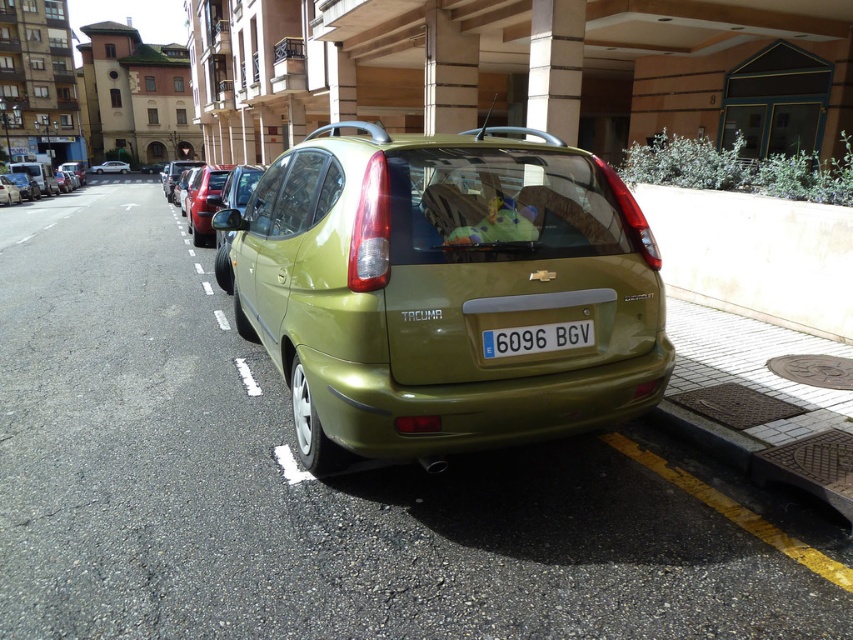
Question: Among these points, which one is nearest to the camera?

Choices:
 (A) (91, 168)
 (B) (57, 166)
 (C) (566, 429)
 (D) (491, 344)

Answer: (D)

Question: Considering the relative positions of olive metallic sedan at center and matte green hatchback at center in the image provided, where is olive metallic sedan at center located with respect to matte green hatchback at center?

Choices:
 (A) right
 (B) left

Answer: (A)

Question: Which object is the farthest from the matte green hatchback at center?

Choices:
 (A) metallic silver sedan at center
 (B) white plastic license plate at center

Answer: (A)

Question: Is white plastic license plate at center bigger than metallic silver car at center?

Choices:
 (A) yes
 (B) no

Answer: (B)

Question: Which is farther from the metallic silver sedan at center?

Choices:
 (A) metallic silver car at center
 (B) white plastic license plate at center
 (C) matte green hatchback at center
 (D) olive metallic sedan at center

Answer: (B)

Question: Considering the relative positions of olive metallic sedan at center and matte green hatchback at center in the image provided, where is olive metallic sedan at center located with respect to matte green hatchback at center?

Choices:
 (A) below
 (B) above

Answer: (A)